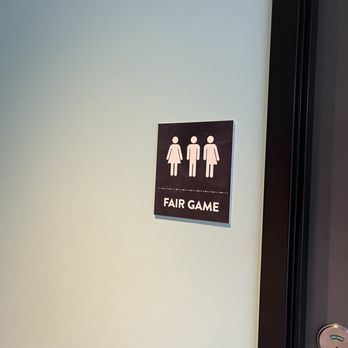
Find the location of a particular element. This screenshot has height=348, width=348. reflection from light on door is located at coordinates (180, 318), (346, 301).